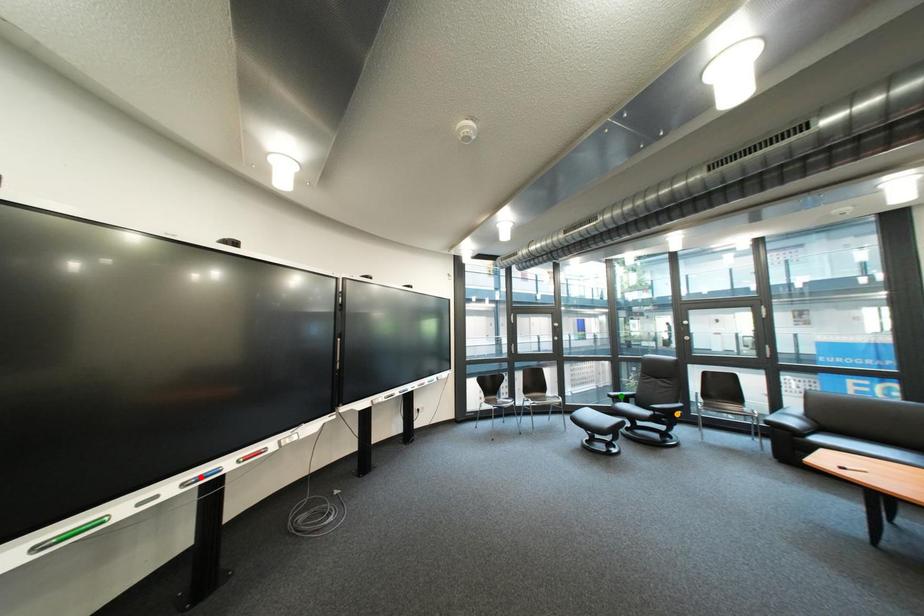
In the scene shown: Order these from farthest to nearest:
1. red point
2. green point
3. orange point

1. green point
2. orange point
3. red point